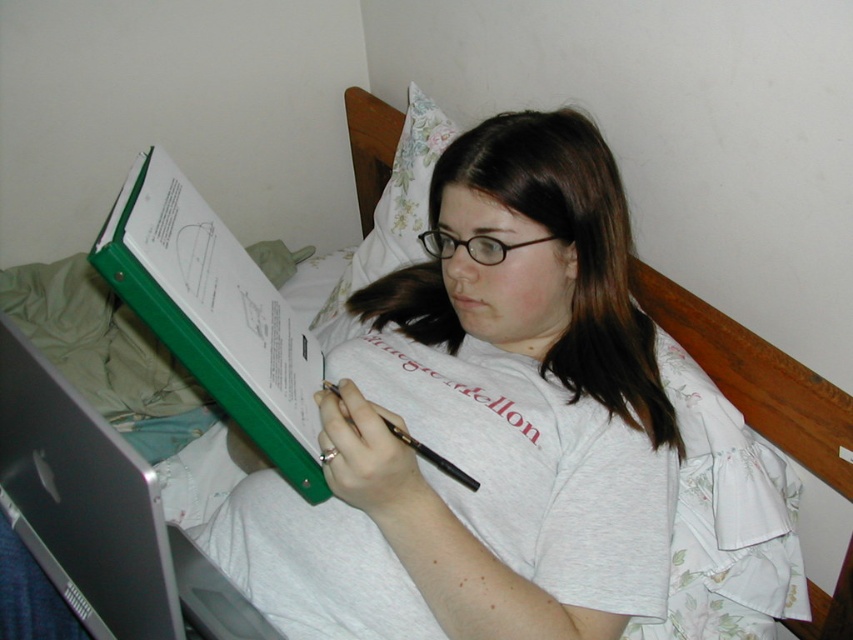
Question: Which point appears farthest from the camera in this image?

Choices:
 (A) (427, 230)
 (B) (404, 436)
 (C) (119, 243)

Answer: (A)

Question: In this image, where is green plastic folder at upper left located relative to black plastic pen at center?

Choices:
 (A) right
 (B) left

Answer: (B)

Question: Does black plastic glasses at center appear on the left side of black plastic pen at center?

Choices:
 (A) yes
 (B) no

Answer: (B)

Question: Does green plastic folder at upper left lie behind black plastic pen at center?

Choices:
 (A) yes
 (B) no

Answer: (B)

Question: Which point is closer to the camera?

Choices:
 (A) (473, 244)
 (B) (431, 458)
 (C) (96, 253)

Answer: (C)

Question: Which point is closer to the camera taking this photo?

Choices:
 (A) (270, 346)
 (B) (399, 433)

Answer: (B)